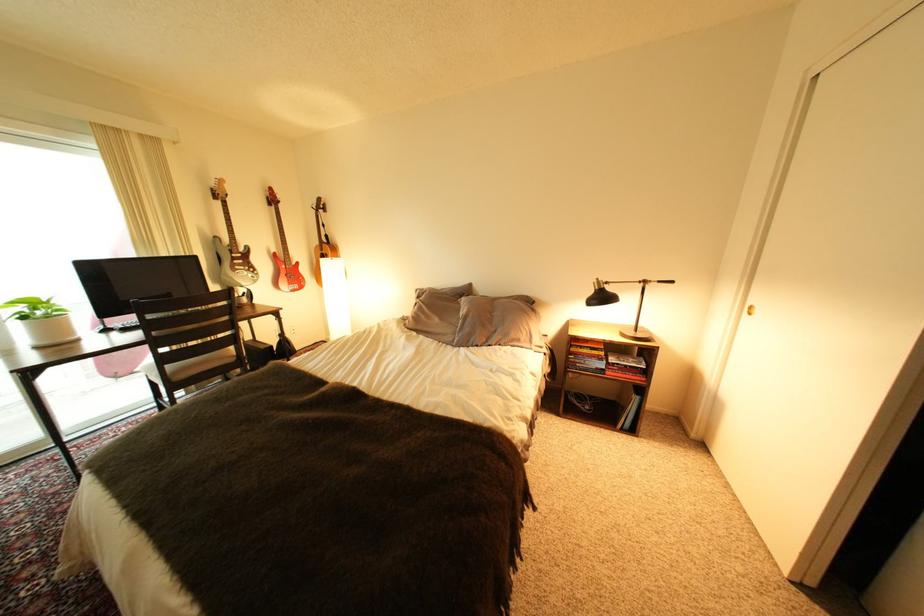
This screenshot has width=924, height=616. What do you see at coordinates (601, 297) in the screenshot?
I see `a black lamp shade` at bounding box center [601, 297].